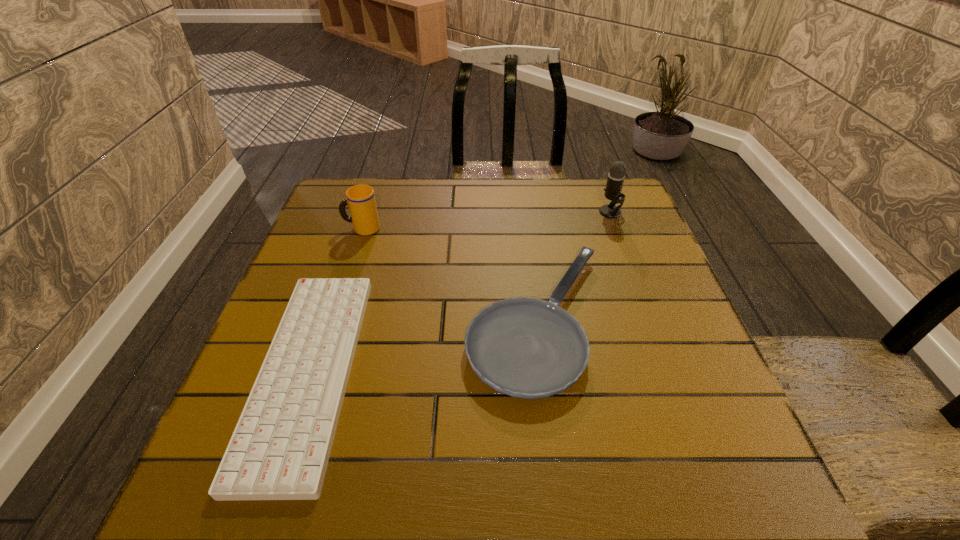
Where is `free spot between the rightmost object and the shortest object`? free spot between the rightmost object and the shortest object is located at coordinates (460, 292).

You are a GUI agent. You are given a task and a screenshot of the screen. Output one action in this format:
    pyautogui.click(x=<x>, y=<y>)
    Task: Click on the second closest object to the third shortest object
    This screenshot has height=540, width=960.
    Given the screenshot: What is the action you would take?
    pyautogui.click(x=529, y=348)

Identify which object is the third closest to the shortest object. Please provide its 2D coordinates. Your answer should be formatted as a tuple, i.e. [(x, y)], where the tuple contains the x and y coordinates of a point satisfying the conditions above.

[(616, 176)]

You are a GUI agent. You are given a task and a screenshot of the screen. Output one action in this format:
    pyautogui.click(x=<x>, y=<y>)
    Task: Click on the free space that satisfies the following two spatial constraints: 1. on the side of the cup with the handle; 2. on the back side of the microphone
    
    Given the screenshot: What is the action you would take?
    pyautogui.click(x=368, y=212)

Where is `vacant point that satisfies the following two spatial constraints: 1. on the side of the farthest object with the handle; 2. on the left side of the second tallest object`? The width and height of the screenshot is (960, 540). vacant point that satisfies the following two spatial constraints: 1. on the side of the farthest object with the handle; 2. on the left side of the second tallest object is located at coordinates (368, 212).

Locate an element on the screen. Image resolution: width=960 pixels, height=540 pixels. free space that satisfies the following two spatial constraints: 1. on the side of the cup with the handle; 2. on the right side of the farthest object is located at coordinates (368, 212).